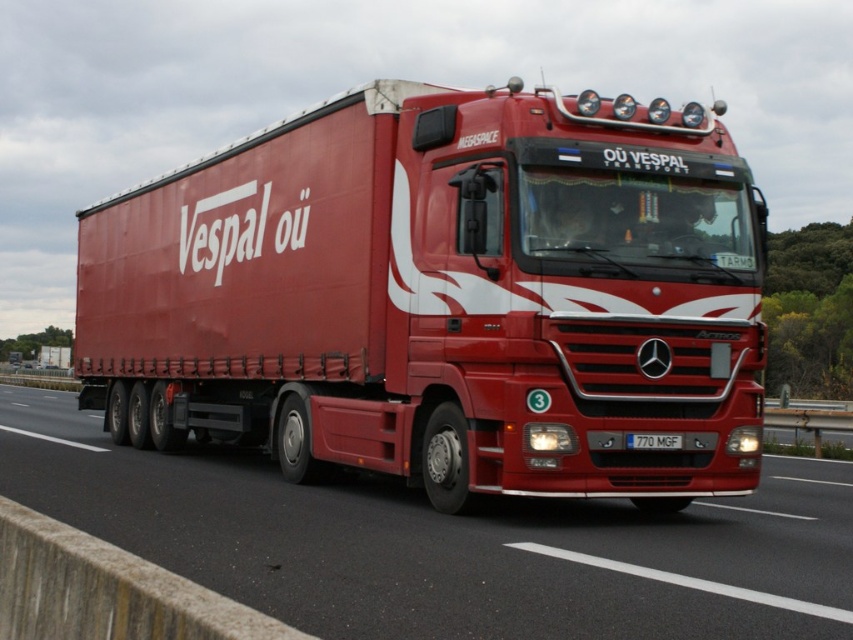
You are a traffic officer assessing vehicle dimensions. The road has a width restriction of 2.55 meters. The license plate on the white plastic license plate at center is 0.5 meters wide. Can the matte red trailer truck at center pass through the restricted area?

The matte red trailer truck at center might be wider than white plastic license plate at center, which is 0.5 meters wide. Since the road restriction is 2.55 meters, if the truck is wider than 2.55 meters, it cannot pass. However, without exact measurements, it is uncertain.

You are a passenger in the truck and looking out the window. You see two points marked on the road ahead. The first point is at coordinate point (437, 257) and the second is at coordinate point (631, 438). Which point is closer to the truck?

Point (437, 257) is closer to the truck because it is further to the viewer than point (631, 438).